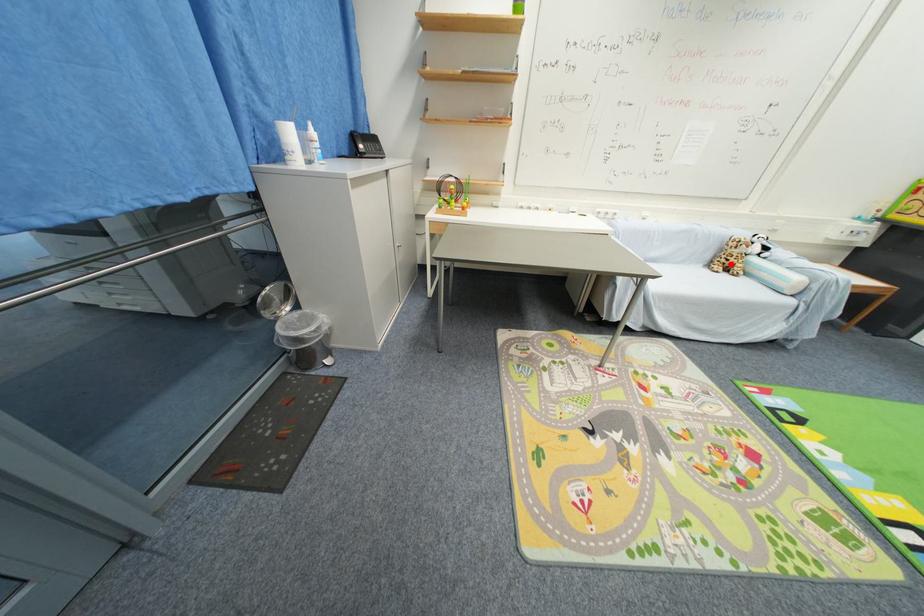
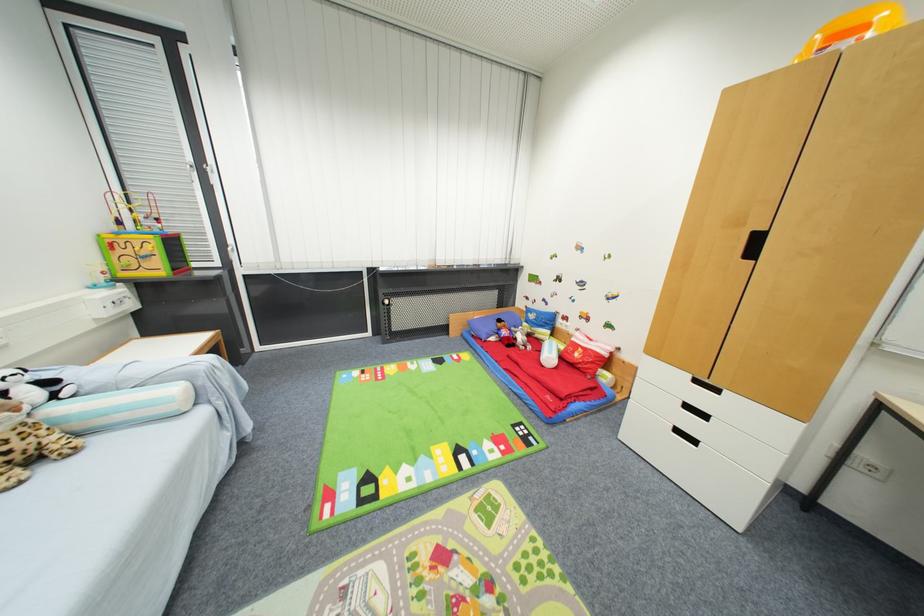
Find the pixel in the second image that matches the highlighted location in the first image.

(7, 456)